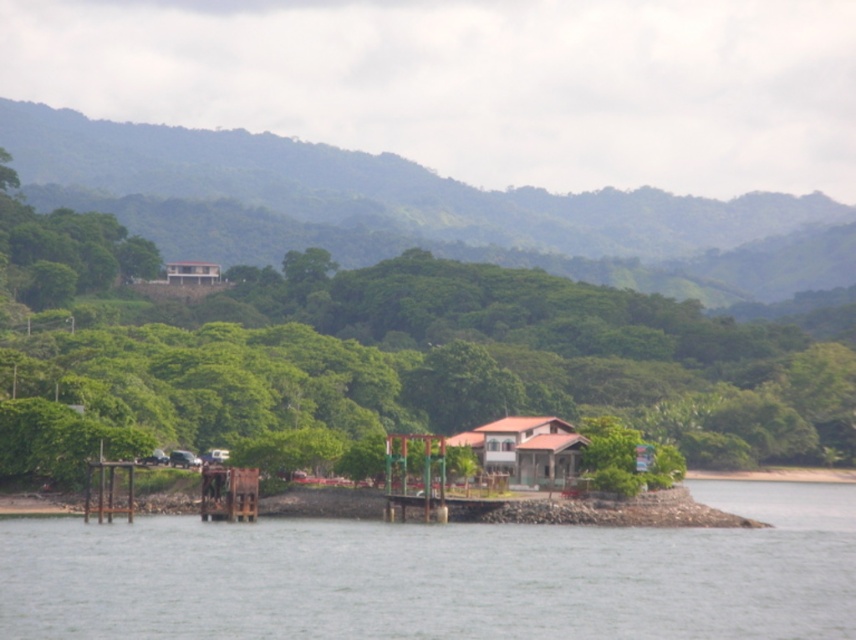
Question: Which object is positioned closest to the rusty metal dock at lower center?

Choices:
 (A) white matte house at upper center
 (B) brown wooden house at center

Answer: (B)

Question: Can you confirm if gray concrete river at lower center is positioned to the left of green leafy hillside at upper center?

Choices:
 (A) no
 (B) yes

Answer: (A)

Question: Which point appears farthest from the camera in this image?

Choices:
 (A) (829, 547)
 (B) (242, 499)
 (C) (509, 417)
 (D) (161, 426)

Answer: (D)

Question: Does brown wooden house at center have a larger size compared to rusty metal dock at lower center?

Choices:
 (A) yes
 (B) no

Answer: (A)

Question: Which is farther from the green leafy tree at center?

Choices:
 (A) green leafy hillside at upper center
 (B) rusty metal dock at lower center
 (C) white matte house at upper center
 (D) gray concrete river at lower center

Answer: (A)

Question: Observing the image, what is the correct spatial positioning of brown wooden house at center in reference to rusty metal dock at lower center?

Choices:
 (A) right
 (B) left

Answer: (A)